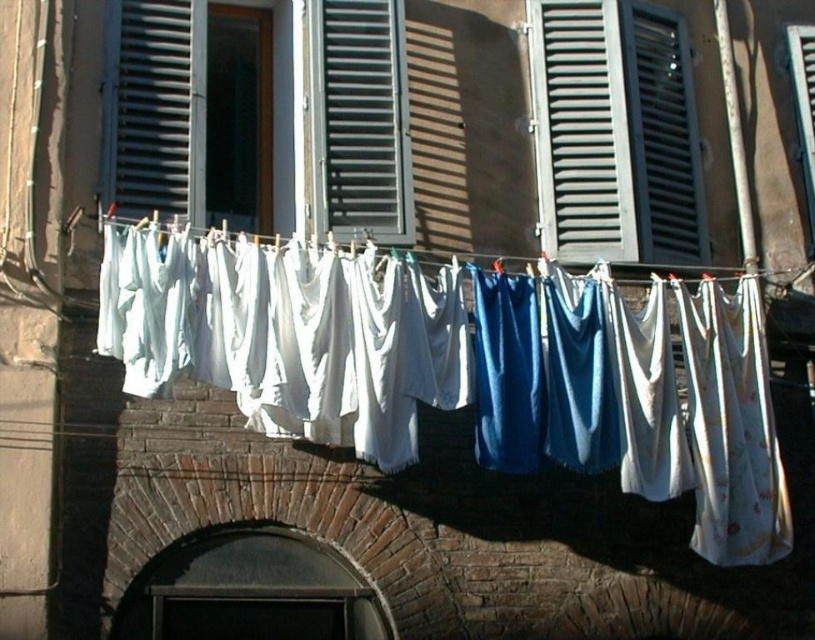
Question: Is the position of white cotton sheets at center less distant than that of matte gray shutters at upper right?

Choices:
 (A) yes
 (B) no

Answer: (A)

Question: Does matte gray shutter at upper left have a lesser width compared to matte gray window at upper right?

Choices:
 (A) yes
 (B) no

Answer: (B)

Question: Which of these objects is positioned farthest from the white fabric at center?

Choices:
 (A) metallic gray shutters at center
 (B) matte gray shutters at upper right
 (C) matte gray window at upper right
 (D) white cotton sheets at center

Answer: (C)

Question: Considering the relative positions of matte gray shutters at upper right and white fabric at center in the image provided, where is matte gray shutters at upper right located with respect to white fabric at center?

Choices:
 (A) left
 (B) right

Answer: (B)

Question: Which object appears closest to the camera in this image?

Choices:
 (A) white cotton sheets at center
 (B) matte gray window at upper right
 (C) matte gray shutter at upper left

Answer: (A)

Question: Which point is closer to the camera?

Choices:
 (A) matte gray window at upper right
 (B) metallic gray shutters at center

Answer: (B)